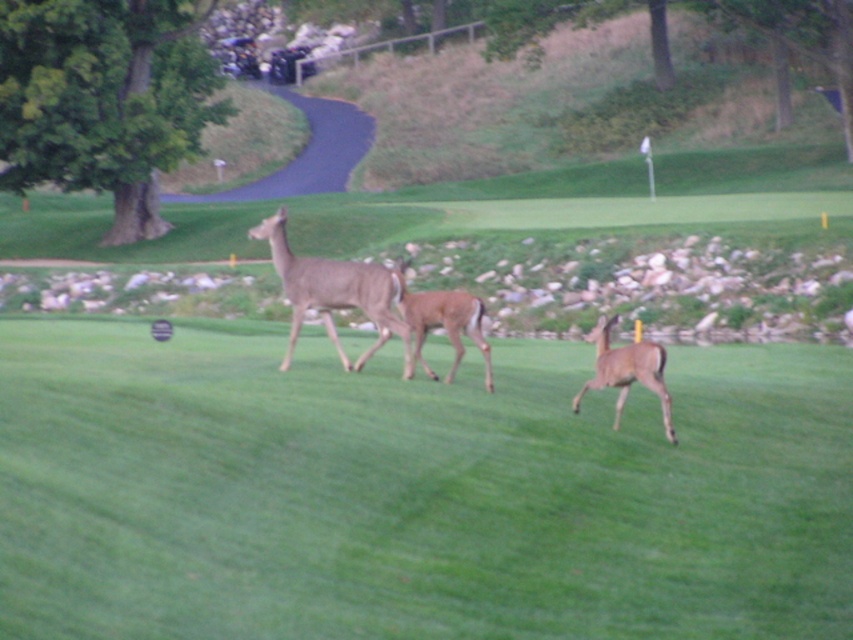
You are standing at the point marked by coordinates point (334, 292). What animal do you see around you?

The point (334, 292) marks the location of a brown fur deer at center, so you are at the position of the brown fur deer at center.

You are a wildlife photographer trying to capture a photo of the two deer in the scene. You notice that the brown fur deer at center and the brown matte deer at center are positioned close to each other. Which deer would you focus on if you want to capture the wider animal in your shot?

The brown fur deer at center is wider than the brown matte deer at center, so focusing on the brown fur deer at center would capture the wider animal in your shot.